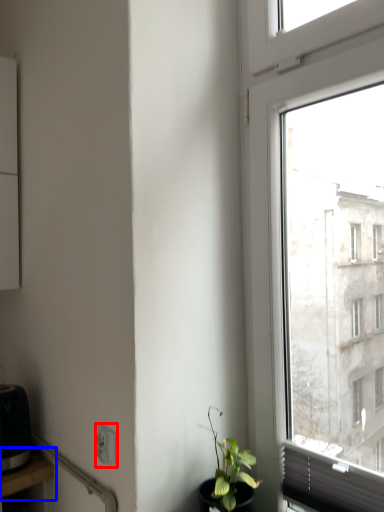
Question: Among these objects, which one is farthest to the camera, power plugs and sockets (highlighted by a red box) or table (highlighted by a blue box)?

Choices:
 (A) power plugs and sockets
 (B) table

Answer: (B)